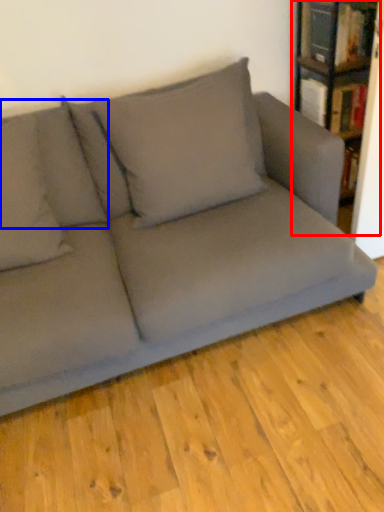
Question: Which object appears farthest to the camera in this image, bookcase (highlighted by a red box) or pillow (highlighted by a blue box)?

Choices:
 (A) bookcase
 (B) pillow

Answer: (A)